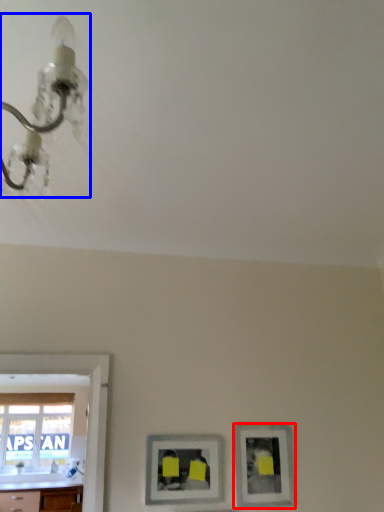
Question: Which object is closer to the camera taking this photo, picture frame (highlighted by a red box) or light fixture (highlighted by a blue box)?

Choices:
 (A) picture frame
 (B) light fixture

Answer: (B)